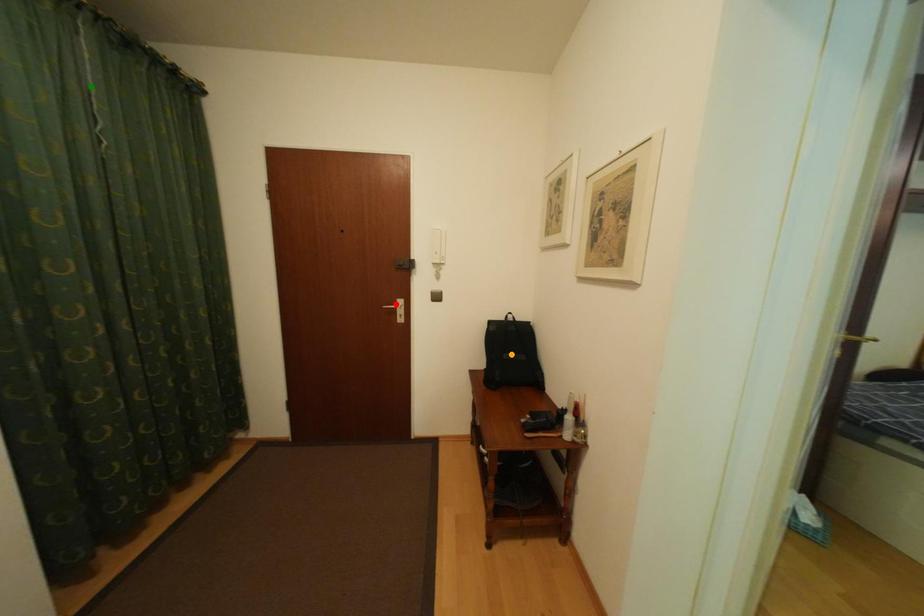
Order these from nearest to farthest:
- red point
- orange point
- green point

green point
red point
orange point